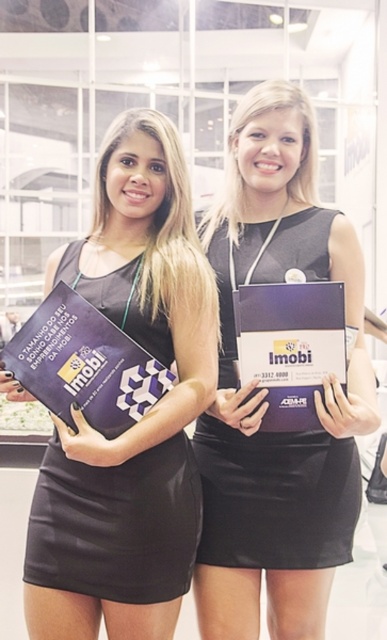
You are attending a formal event and need to place your black leather dress at center and matte purple booklet at center into a small storage locker. Which item should you place first to ensure both fit inside?

The black leather dress at center is located below the matte purple booklet at center, so you should place the matte purple booklet at center first to make space for the dress.